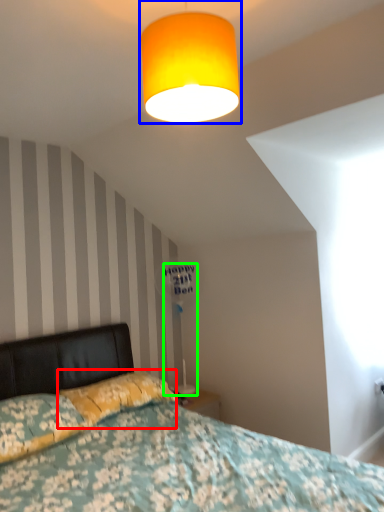
Question: Considering the real-world distances, which object is closest to pillow (highlighted by a red box)? lamp (highlighted by a blue box) or table lamp (highlighted by a green box).

Choices:
 (A) lamp
 (B) table lamp

Answer: (B)